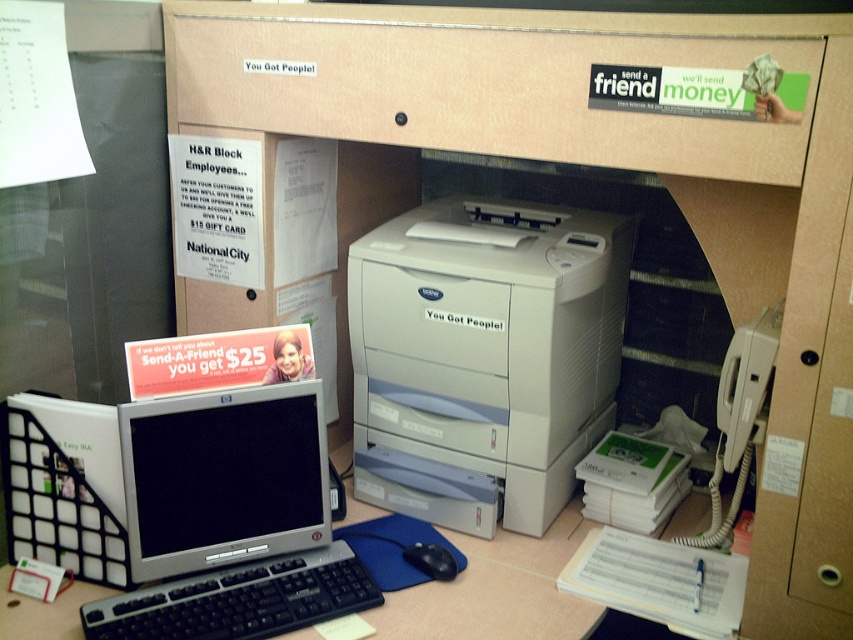
Between point (331, 104) and point (322, 618), which one is positioned in front?

Point (322, 618) is more forward.

Consider the image. Is matte cardboard drawer at upper center taller than black plastic keyboard at lower left?

Indeed, matte cardboard drawer at upper center has a greater height compared to black plastic keyboard at lower left.

Find the location of a particular element. matte cardboard drawer at upper center is located at coordinates (482, 81).

Locate an element on the screen. matte cardboard drawer at upper center is located at coordinates (482, 81).

Which is above, silver metallic monitor at lower left or black plastic keyboard at lower left?

Positioned higher is silver metallic monitor at lower left.

Is silver metallic monitor at lower left further to the viewer compared to black plastic keyboard at lower left?

Yes, silver metallic monitor at lower left is behind black plastic keyboard at lower left.

Locate an element on the screen. This screenshot has width=853, height=640. silver metallic monitor at lower left is located at coordinates (229, 518).

Can you confirm if matte cardboard drawer at upper center is thinner than silver metallic monitor at lower left?

In fact, matte cardboard drawer at upper center might be wider than silver metallic monitor at lower left.

Which is behind, point (527, 68) or point (160, 508)?

Positioned behind is point (160, 508).

Find the location of a particular element. This screenshot has width=853, height=640. matte cardboard drawer at upper center is located at coordinates (482, 81).

Where is `matte cardboard drawer at upper center`? The height and width of the screenshot is (640, 853). matte cardboard drawer at upper center is located at coordinates (482, 81).